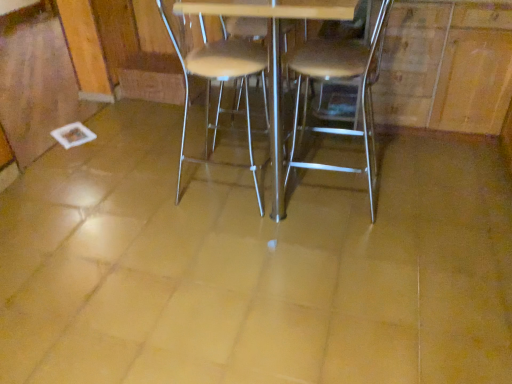
Question: Based on their positions, is metallic silver table at center located to the left or right of metallic silver chair at center, which appears as the first chair when viewed from the left?

Choices:
 (A) left
 (B) right

Answer: (B)

Question: Considering the positions of metallic silver table at center and metallic silver chair at center, which appears as the first chair when viewed from the left, in the image, is metallic silver table at center taller or shorter than metallic silver chair at center, which appears as the first chair when viewed from the left,?

Choices:
 (A) short
 (B) tall

Answer: (B)

Question: Based on their relative distances, which object is farther from the metallic silver chair at center, the first chair positioned from the right?

Choices:
 (A) metallic silver chair at center, which appears as the first chair when viewed from the left
 (B) metallic silver table at center

Answer: (B)

Question: Based on their relative distances, which object is nearer to the metallic silver chair at center, which appears as the 2th chair when viewed from the left?

Choices:
 (A) metallic silver chair at center, which appears as the first chair when viewed from the left
 (B) metallic silver table at center

Answer: (A)